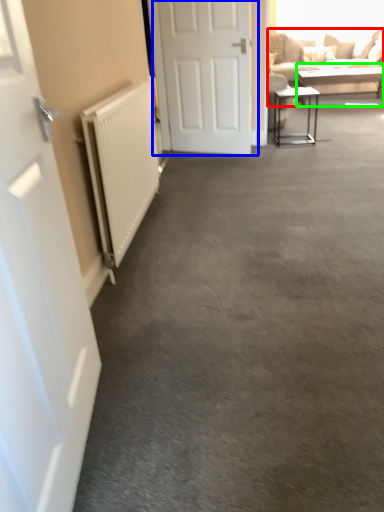
Question: Based on their relative distances, which object is farther from studio couch (highlighted by a red box)? Choose from door (highlighted by a blue box) and table (highlighted by a green box).

Choices:
 (A) door
 (B) table

Answer: (A)